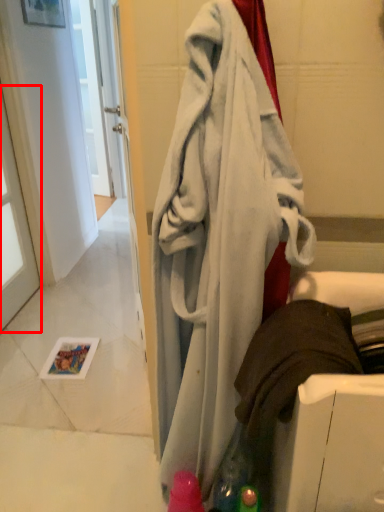
Question: From the image, what is the correct spatial relationship of window (annotated by the red box) in relation to towel?

Choices:
 (A) left
 (B) right

Answer: (A)